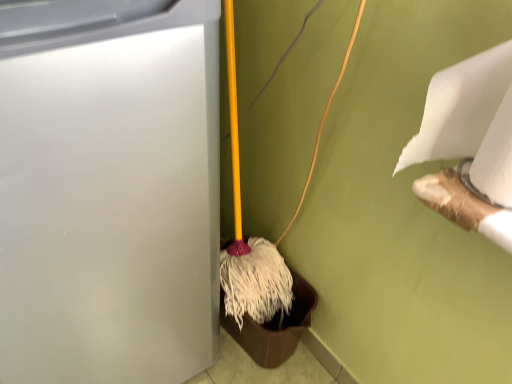
Question: From the image's perspective, is white matte toilet paper at upper right, positioned as the 1th toilet paper in left-to-right order, above or below white matte toilet paper at upper right, which is the 1th toilet paper in right-to-left order?

Choices:
 (A) above
 (B) below

Answer: (B)

Question: Would you say white matte toilet paper at upper right, placed as the 2th toilet paper when sorted from right to left, is inside or outside white matte toilet paper at upper right, which is the 1th toilet paper in right-to-left order?

Choices:
 (A) outside
 (B) inside

Answer: (B)

Question: Which object is positioned closest to the white matte waste container at left?

Choices:
 (A) white matte toilet paper at upper right, placed as the 2th toilet paper when sorted from right to left
 (B) white matte toilet paper at upper right, which is the second toilet paper in left-to-right order

Answer: (A)

Question: Which object is the farthest from the white matte toilet paper at upper right, which is the second toilet paper in left-to-right order?

Choices:
 (A) white matte toilet paper at upper right, placed as the 2th toilet paper when sorted from right to left
 (B) white matte waste container at left

Answer: (B)